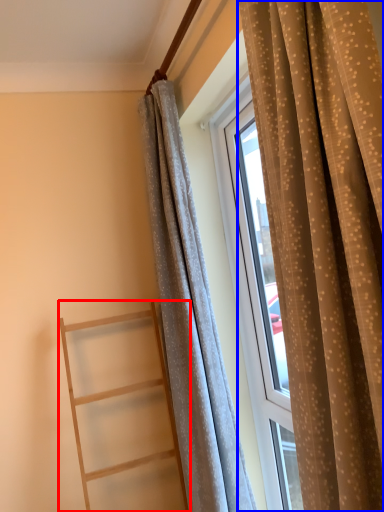
Question: Which point is further to the camera, ladder (highlighted by a red box) or curtain (highlighted by a blue box)?

Choices:
 (A) ladder
 (B) curtain

Answer: (A)